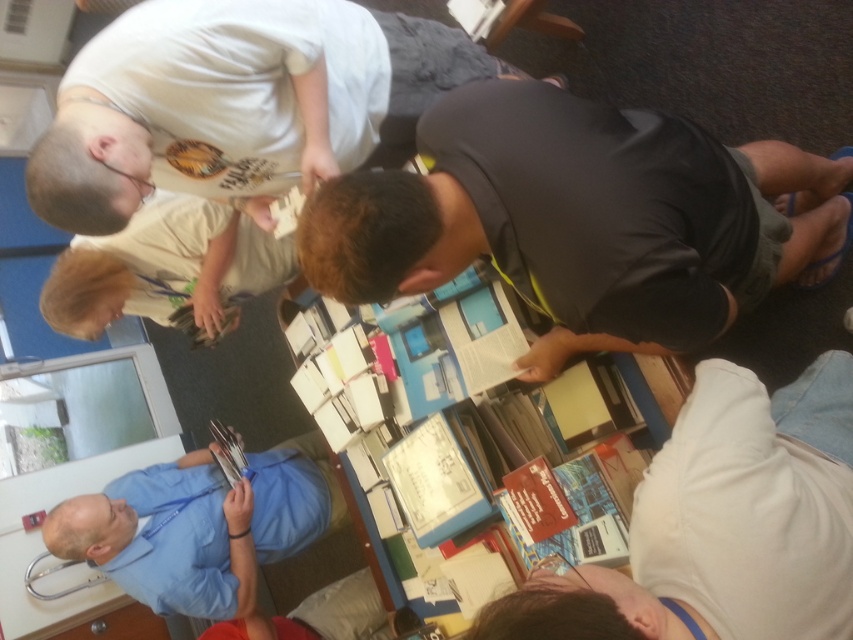
You are organizing a clothing donation drive and need to determine which shirts can fit into a narrow storage bin. The bin can only accommodate shirts with a width of 30 cm or less. According to the image, can the white fabric shirt at lower right and the blue fabric shirt at lower left both fit into the bin?

The white fabric shirt at lower right is thinner than the blue fabric shirt at lower left. Since the bin can only hold shirts up to 30 cm wide, we need to know the exact width of the white shirt. If the white shirt is under 30 cm, it fits, but the blue shirt might be too wide. However, without specific measurements, we can only compare their relative thickness. The description only states the white is thinner, not its exact size.

You are organizing a photo shoot and need to place two shirts on a table for a catalog. The black matte shirt at center and the blue fabric shirt at lower left must be arranged so that the wider shirt is placed on the right side of the table. Which shirt should go on the right?

The black matte shirt at center is wider than the blue fabric shirt at lower left, so it should be placed on the right side of the table.